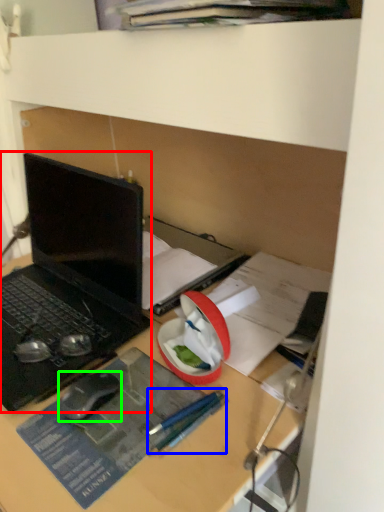
Question: Considering the real-world distances, which object is farthest from laptop (highlighted by a red box)? pencil (highlighted by a blue box) or mouse (highlighted by a green box)?

Choices:
 (A) pencil
 (B) mouse

Answer: (A)